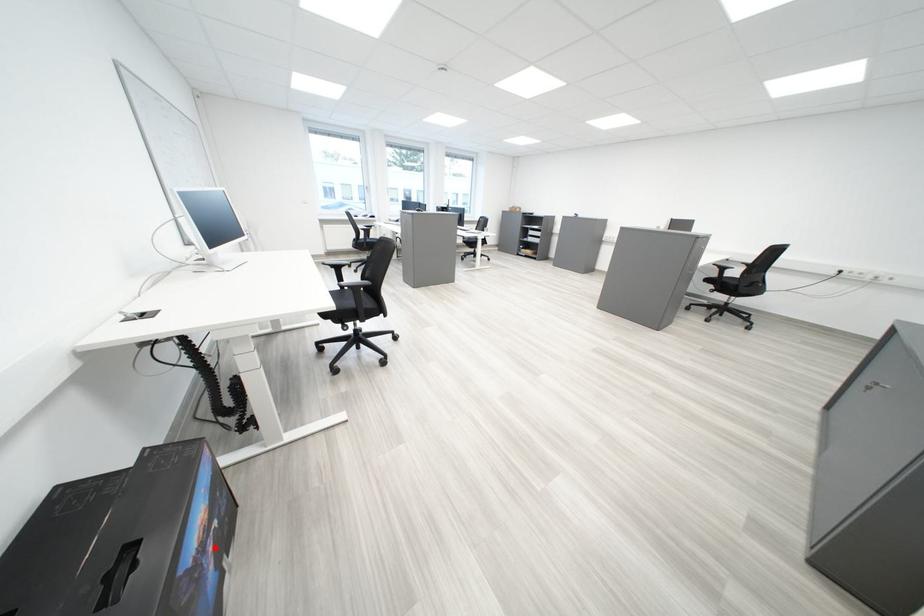
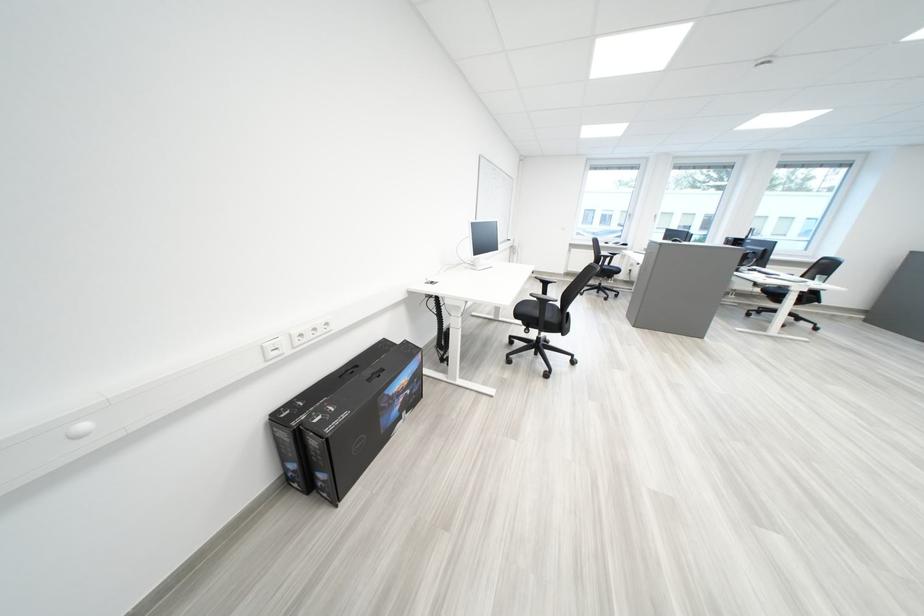
In the second image, find the point that corresponds to the highlighted location in the first image.

(411, 395)